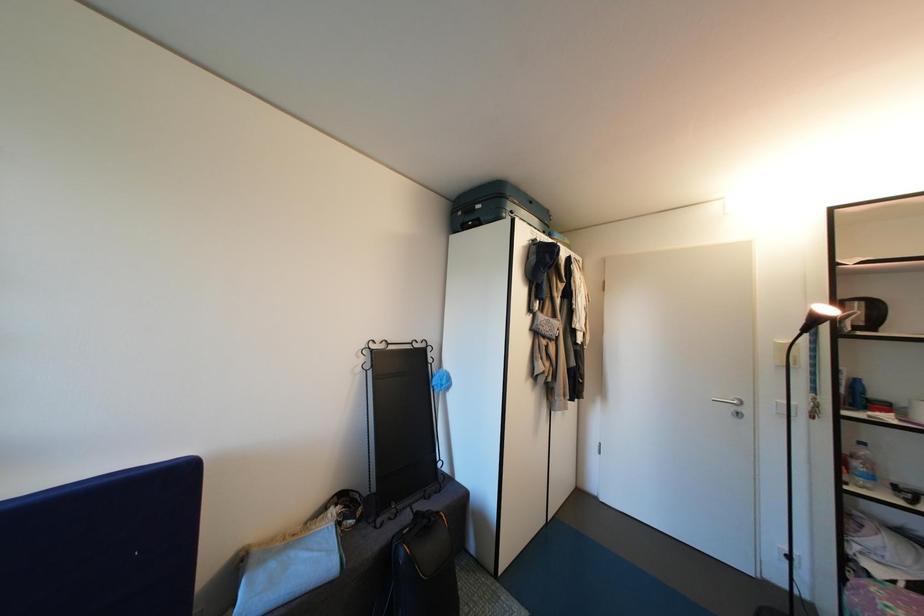
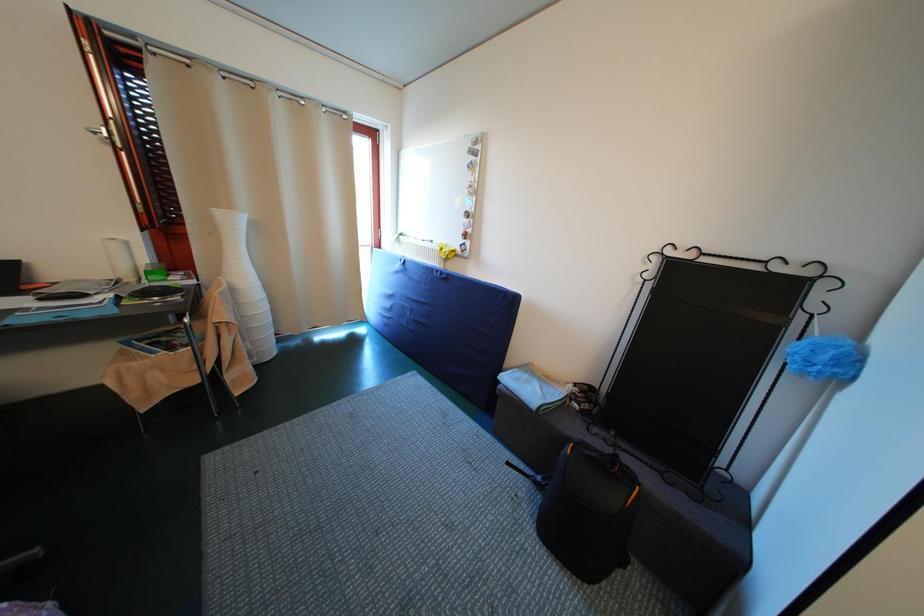
How did the camera likely rotate?

The camera rotated toward left-down.